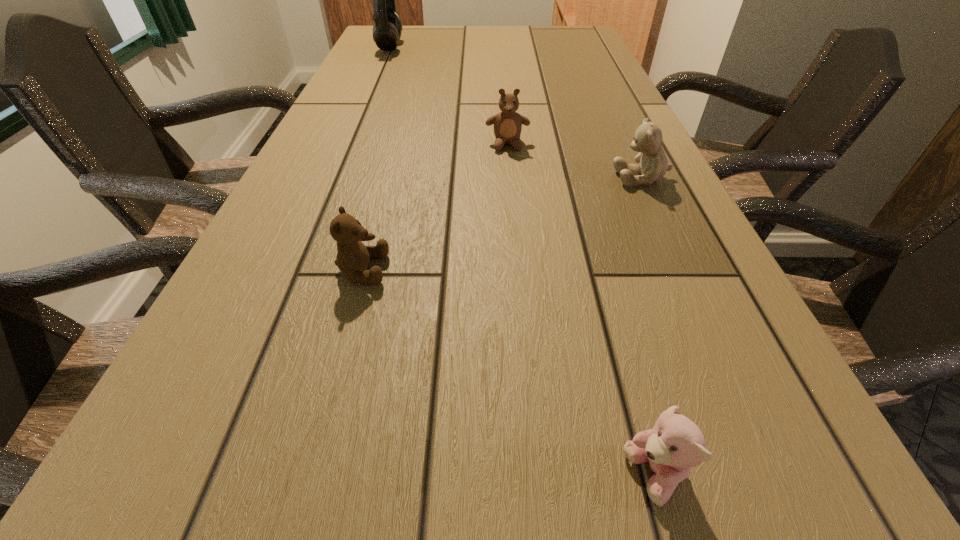
Where is `the leftmost object`? The width and height of the screenshot is (960, 540). the leftmost object is located at coordinates pyautogui.click(x=387, y=29).

The height and width of the screenshot is (540, 960). In order to click on the farthest object in this screenshot , I will do `click(387, 29)`.

This screenshot has height=540, width=960. I want to click on the second farthest object, so click(507, 124).

Identify the location of the farthest teddy bear. (507, 124).

I want to click on the second farthest teddy bear, so click(653, 165).

Where is `the rightmost teddy bear`? the rightmost teddy bear is located at coordinates (653, 165).

Locate an element on the screen. the second nearest object is located at coordinates (353, 257).

The width and height of the screenshot is (960, 540). In order to click on the second nearest teddy bear in this screenshot , I will do `click(353, 257)`.

This screenshot has height=540, width=960. Identify the location of the second teddy bear from right to left. (675, 444).

Where is `the second object from right to left`? This screenshot has height=540, width=960. the second object from right to left is located at coordinates (675, 444).